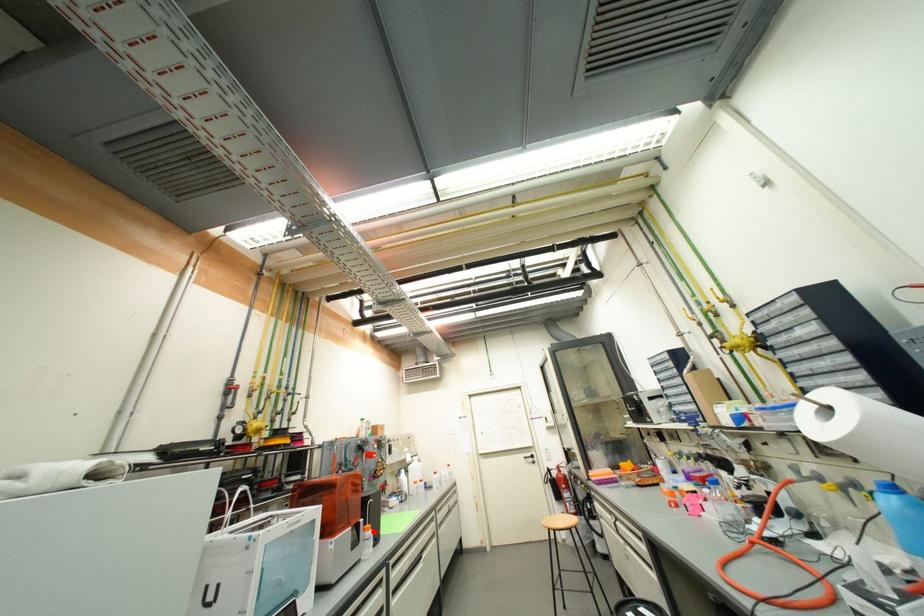
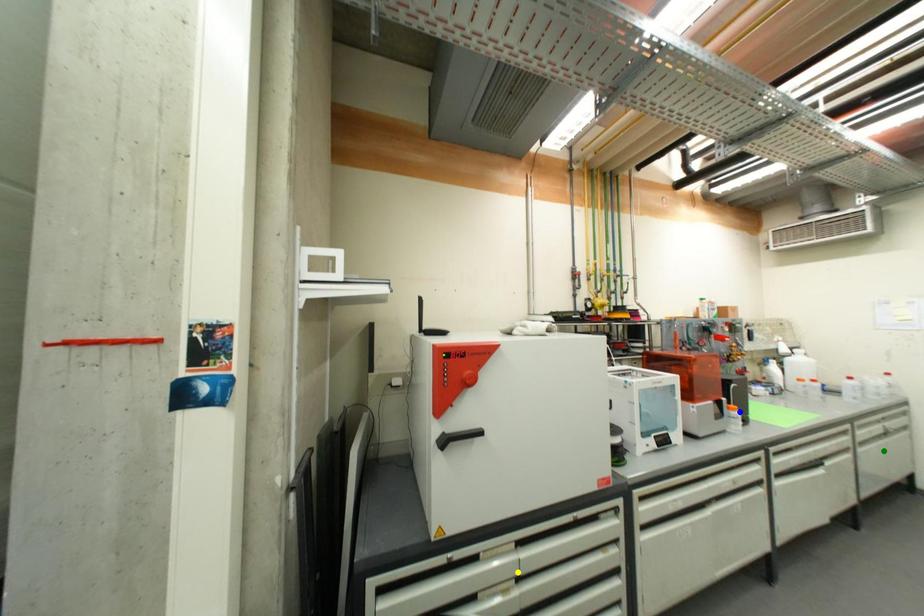
Question: I am providing you with two images of the same scene from different viewpoints. A red point is marked on the first image. You are given multiple points on the second image. Which spot in image 2 lines up with the point in image 1?

Choices:
 (A) blue point
 (B) yellow point
 (C) green point

Answer: (A)